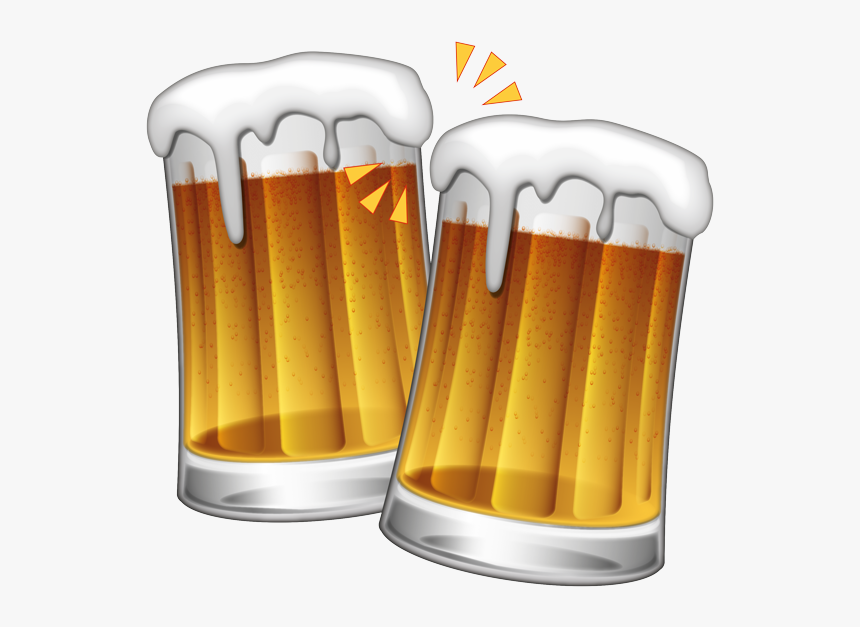
In order to click on glass in this screenshot , I will do `click(539, 404)`, `click(336, 280)`.